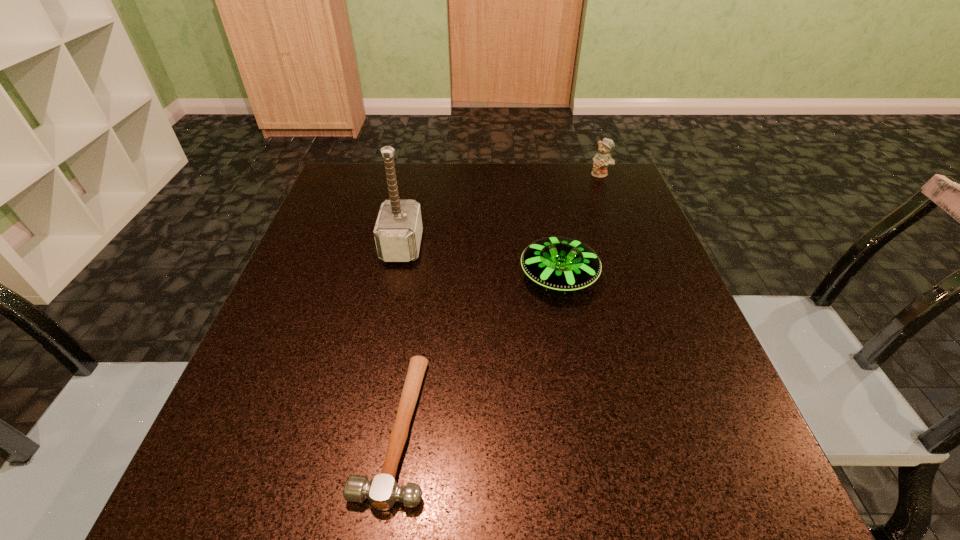
Locate an element on the screen. This screenshot has height=540, width=960. empty space that is in between the taller hammer and the second object from right to left is located at coordinates (480, 262).

In order to click on free spot between the second tallest object and the farther hammer in this screenshot , I will do `click(501, 210)`.

Locate an element on the screen. free spot between the third shortest object and the saucer is located at coordinates (580, 226).

Locate an element on the screen. The width and height of the screenshot is (960, 540). vacant space in between the farther hammer and the nearest object is located at coordinates (399, 337).

This screenshot has height=540, width=960. What are the coordinates of `object that is the third closest to the saucer` in the screenshot? It's located at (601, 160).

In order to click on the second closest object to the nearer hammer in this screenshot , I will do `click(398, 230)`.

Where is `vacant space that satisfies the following two spatial constraints: 1. on the front-facing side of the farthest object; 2. for striking with the head of the taller hammer`? The image size is (960, 540). vacant space that satisfies the following two spatial constraints: 1. on the front-facing side of the farthest object; 2. for striking with the head of the taller hammer is located at coordinates (629, 246).

Locate an element on the screen. The height and width of the screenshot is (540, 960). vacant region that satisfies the following two spatial constraints: 1. for striking with the head of the taller hammer; 2. on the right side of the third tallest object is located at coordinates (396, 277).

Find the location of a particular element. vacant space that satisfies the following two spatial constraints: 1. for striking with the head of the nearest object; 2. on the right side of the farther hammer is located at coordinates (365, 427).

Where is `vacant region that satisfies the following two spatial constraints: 1. for striking with the head of the farther hammer; 2. on the back side of the saucer`? This screenshot has height=540, width=960. vacant region that satisfies the following two spatial constraints: 1. for striking with the head of the farther hammer; 2. on the back side of the saucer is located at coordinates (396, 277).